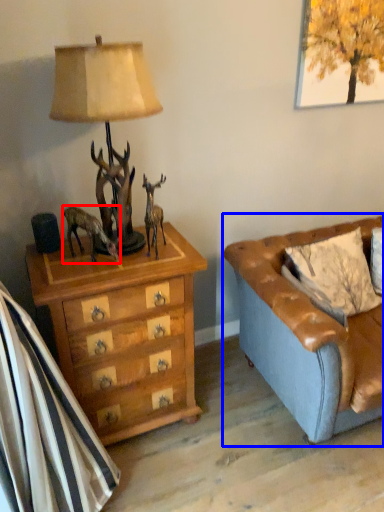
Question: Which of the following is the closest to the observer, animal (highlighted by a red box) or studio couch (highlighted by a blue box)?

Choices:
 (A) animal
 (B) studio couch

Answer: (B)